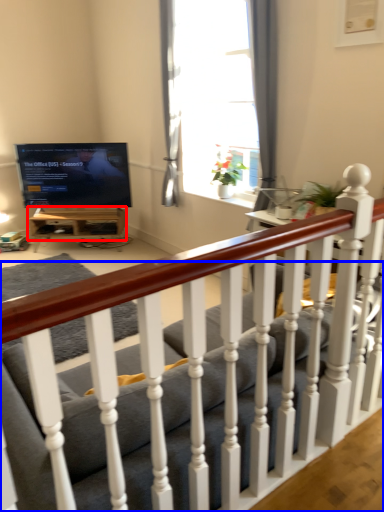
Question: Which point is closer to the camera, table (highlighted by a red box) or studio couch (highlighted by a blue box)?

Choices:
 (A) table
 (B) studio couch

Answer: (B)